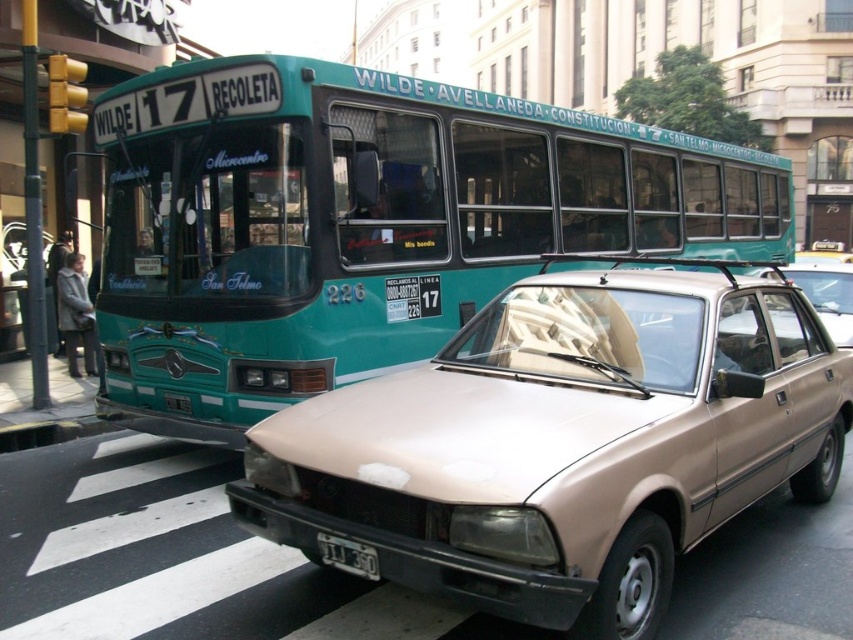
This screenshot has height=640, width=853. What are the coordinates of `beige matte sedan at center` in the screenshot? It's located at (564, 444).

Which is below, beige matte sedan at center or white plastic license plate at lower center?

white plastic license plate at lower center is lower down.

Where is `beige matte sedan at center`? beige matte sedan at center is located at coordinates (564, 444).

Can you confirm if teal glossy bus at upper left is smaller than white plastic license plate at lower center?

Actually, teal glossy bus at upper left might be larger than white plastic license plate at lower center.

Find the location of a particular element. This screenshot has width=853, height=640. teal glossy bus at upper left is located at coordinates click(364, 225).

Where is `teal glossy bus at upper left`? Image resolution: width=853 pixels, height=640 pixels. teal glossy bus at upper left is located at coordinates (364, 225).

Is point (746, 248) behind point (477, 353)?

Yes, point (746, 248) is farther from viewer.

Between point (91, 284) and point (795, 381), which one is positioned behind?

The point (91, 284) is more distant.

This screenshot has height=640, width=853. I want to click on teal glossy bus at upper left, so click(x=364, y=225).